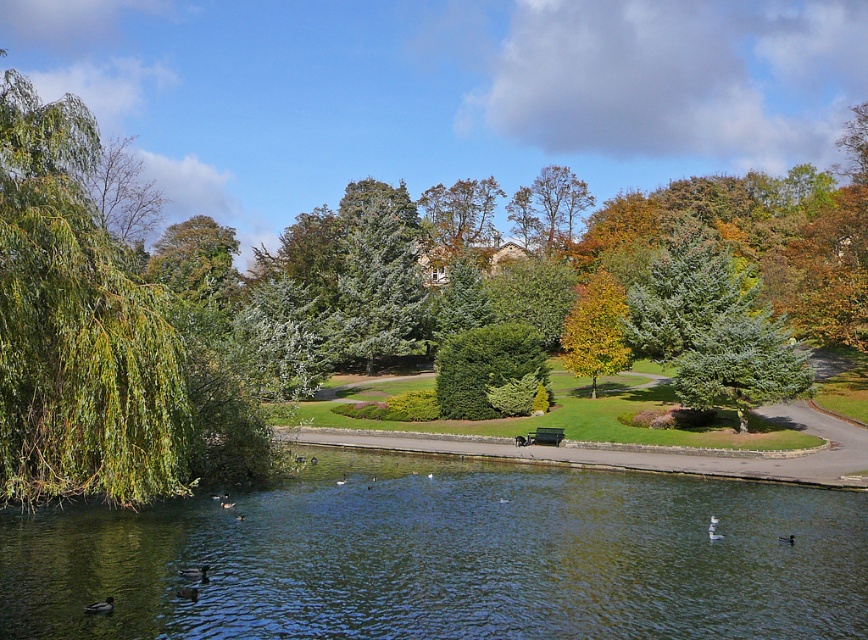
Question: Which of the following is the closest to the observer?

Choices:
 (A) (221, 500)
 (B) (528, 196)
 (C) (74, 632)
 (D) (204, 564)

Answer: (C)

Question: Which object is the farthest from the green leafy tree at left?

Choices:
 (A) green matte duck at lower left
 (B) yellow-green foliage at center
 (C) dark brown duck at lower left

Answer: (B)

Question: Can you confirm if dark brown feathers at lower left is positioned to the left of dark brown duck at lower left?

Choices:
 (A) yes
 (B) no

Answer: (A)

Question: Does dark gray matte duck at lower right lie behind brown fuzzy duck at lower left?

Choices:
 (A) no
 (B) yes

Answer: (A)

Question: Does dark brown duck at lower left appear on the right side of brown matte duck at lower left?

Choices:
 (A) no
 (B) yes

Answer: (B)

Question: Based on their relative distances, which object is farther from the brown fuzzy duck at lower left?

Choices:
 (A) brown matte duck at lower left
 (B) green reflective water at center
 (C) dark brown feathers at lower left
 (D) dark gray matte duck at lower right

Answer: (D)